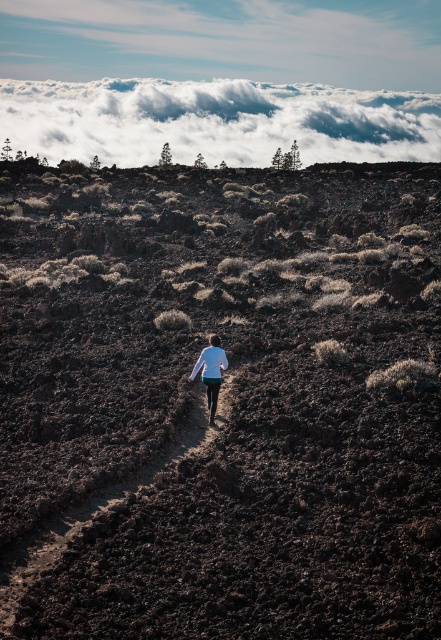
Question: From the image, what is the correct spatial relationship of dirt path at center in relation to white matte shirt at center?

Choices:
 (A) below
 (B) above

Answer: (A)

Question: Which of the following is the farthest from the observer?

Choices:
 (A) (145, 80)
 (B) (98, 380)

Answer: (A)

Question: Which point is closer to the camera?

Choices:
 (A) (205, 371)
 (B) (202, 406)
 (C) (399, 330)
 (D) (399, 134)

Answer: (A)

Question: Is dirt path at center smaller than white matte shirt at center?

Choices:
 (A) no
 (B) yes

Answer: (A)

Question: Which object appears farthest from the camera in this image?

Choices:
 (A) dirt path at center
 (B) white fluffy cloud at upper center
 (C) dull brown soil at center

Answer: (B)

Question: Is dull brown soil at center in front of dirt path at center?

Choices:
 (A) no
 (B) yes

Answer: (A)